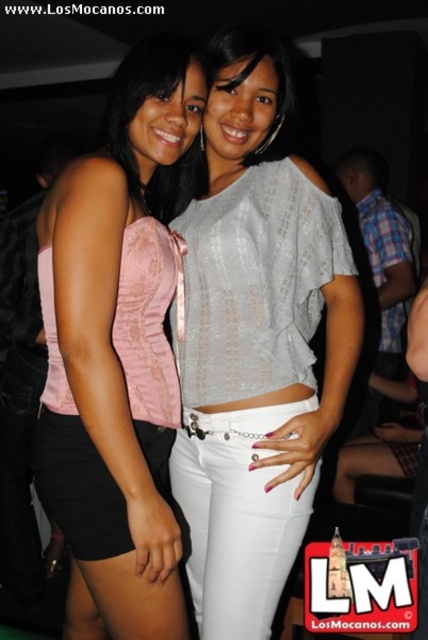
Question: Which of the following is the closest to the observer?

Choices:
 (A) light gray lace blouse at center
 (B) pink satin top at left

Answer: (B)

Question: Which object appears closest to the camera in this image?

Choices:
 (A) light gray lace blouse at center
 (B) pink satin top at left

Answer: (B)

Question: Is light gray lace blouse at center positioned at the back of pink satin top at left?

Choices:
 (A) yes
 (B) no

Answer: (A)

Question: Is light gray lace blouse at center below pink satin top at left?

Choices:
 (A) no
 (B) yes

Answer: (B)

Question: Can you confirm if light gray lace blouse at center is bigger than pink satin top at left?

Choices:
 (A) yes
 (B) no

Answer: (A)